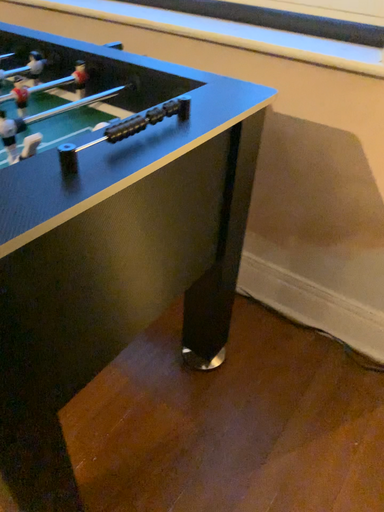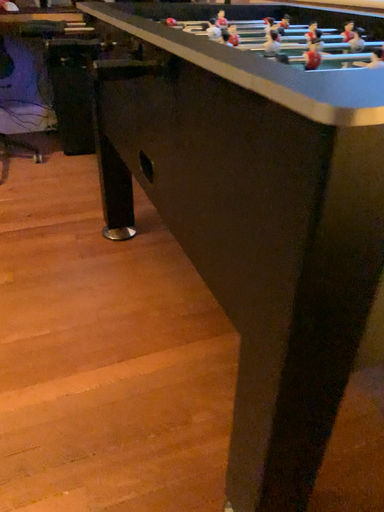
Question: How did the camera likely rotate when shooting the video?

Choices:
 (A) rotated left
 (B) rotated right

Answer: (A)